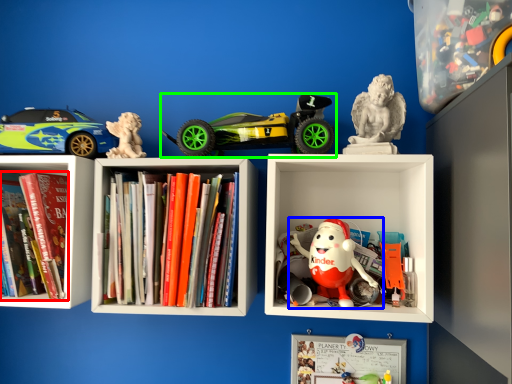
Question: Estimate the real-world distances between objects in this image. Which object is farther from book (highlighted by a red box), toy (highlighted by a blue box) or toy (highlighted by a green box)?

Choices:
 (A) toy
 (B) toy

Answer: (A)